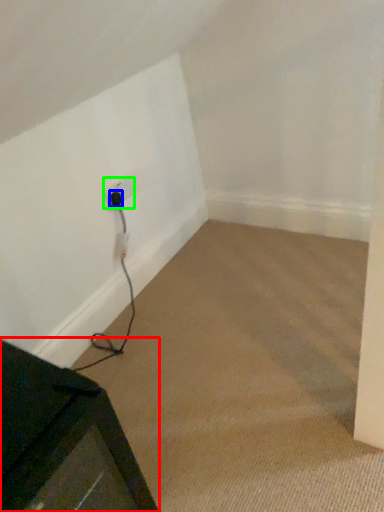
Question: Which is farther away from furniture (highlighted by a red box)? plug (highlighted by a blue box) or electric outlet (highlighted by a green box)?

Choices:
 (A) plug
 (B) electric outlet

Answer: (A)